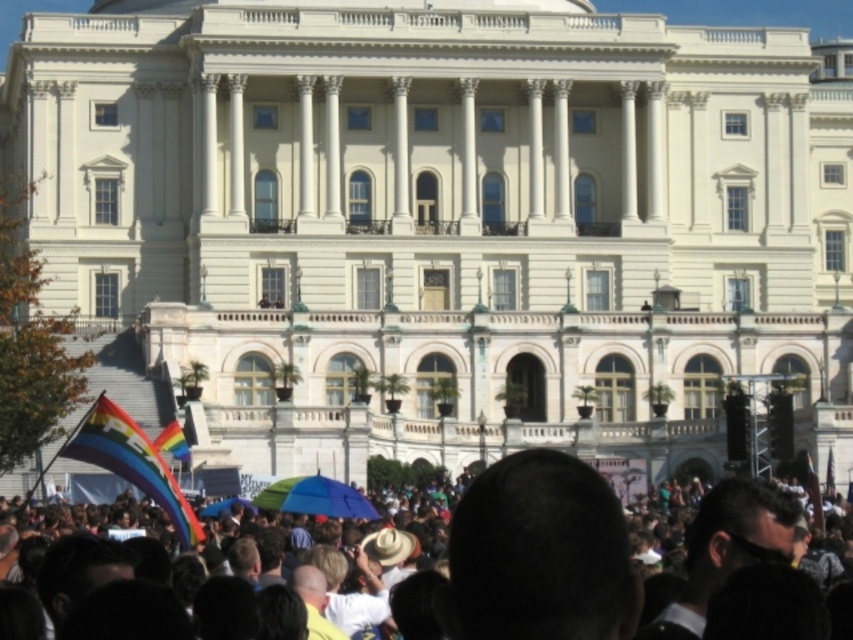
Can you confirm if rainbow fabric crowd at lower center is bigger than rainbow fabric umbrella at center?

Correct, rainbow fabric crowd at lower center is larger in size than rainbow fabric umbrella at center.

Does point (616, 572) lie in front of point (271, 493)?

Yes, it is in front of point (271, 493).

Does point (553, 508) lie in front of point (368, 509)?

Yes, point (553, 508) is closer to viewer.

Locate an element on the screen. Image resolution: width=853 pixels, height=640 pixels. rainbow fabric crowd at lower center is located at coordinates (535, 556).